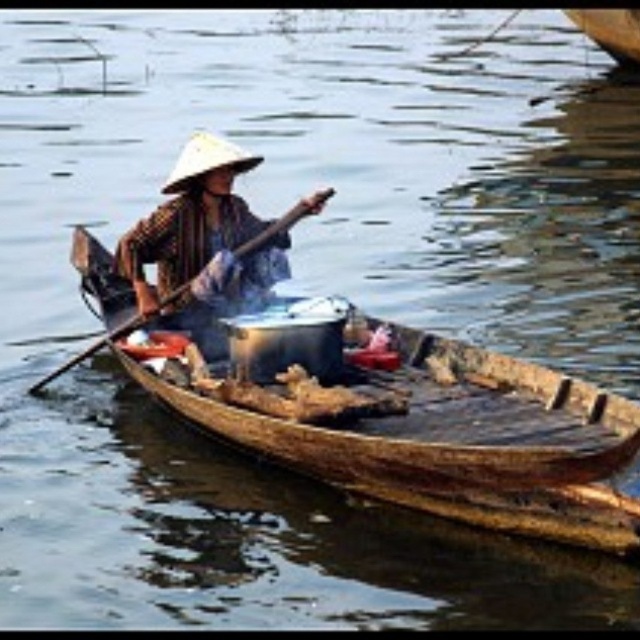
How distant is wooden paddle at center from wooden boat at upper right?

The distance of wooden paddle at center from wooden boat at upper right is 162.36 feet.

Measure the distance from wooden paddle at center to wooden boat at upper right.

They are 162.36 feet apart.

Find the location of `wooden paddle at center`. wooden paddle at center is located at coordinates (284, 221).

Does brown woven hat at center appear over wooden boat at upper right?

No, brown woven hat at center is not above wooden boat at upper right.

Is brown woven hat at center behind wooden boat at upper right?

No, it is not.

What do you see at coordinates (202, 241) in the screenshot? The height and width of the screenshot is (640, 640). I see `brown woven hat at center` at bounding box center [202, 241].

The image size is (640, 640). Find the location of `brown woven hat at center`. brown woven hat at center is located at coordinates (202, 241).

Can you confirm if white straw hat at center is positioned to the right of wooden boat at upper right?

In fact, white straw hat at center is to the left of wooden boat at upper right.

Which is in front, point (209, 138) or point (627, 42)?

Point (209, 138) is in front.

Describe the element at coordinates (205, 161) in the screenshot. The image size is (640, 640). I see `white straw hat at center` at that location.

Image resolution: width=640 pixels, height=640 pixels. I want to click on white straw hat at center, so click(x=205, y=161).